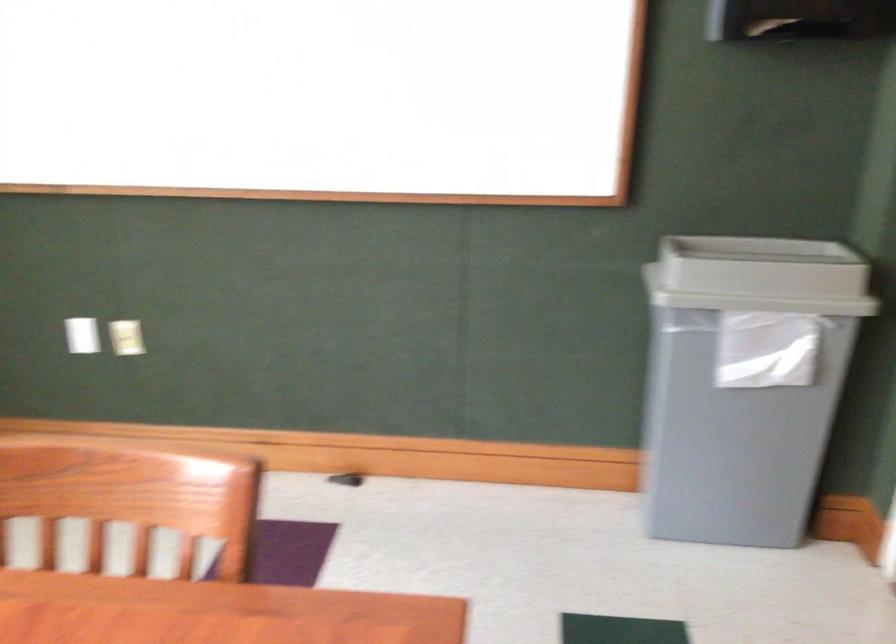
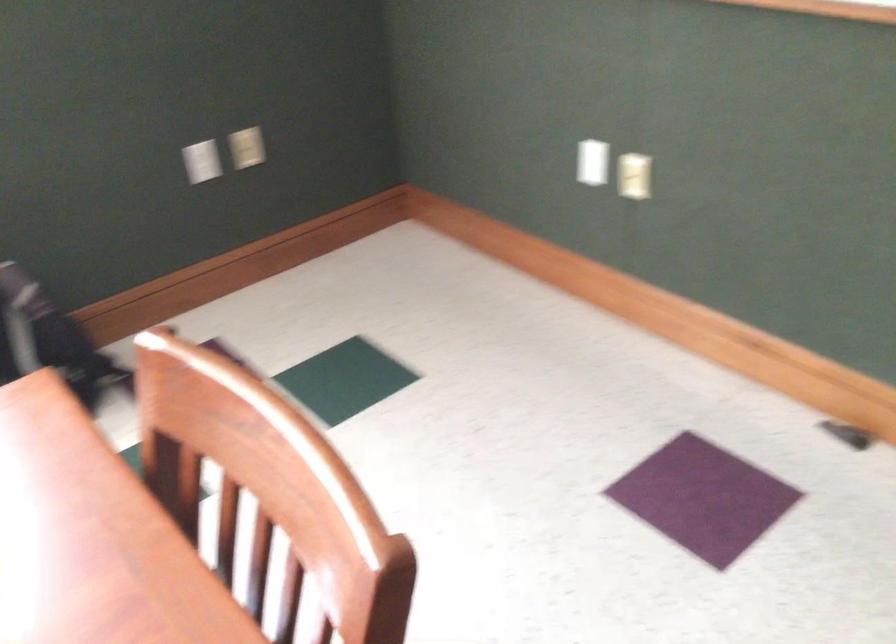
The images are taken continuously from a first-person perspective. In which direction is your viewpoint rotating?

The rotation direction of the camera is left-down.